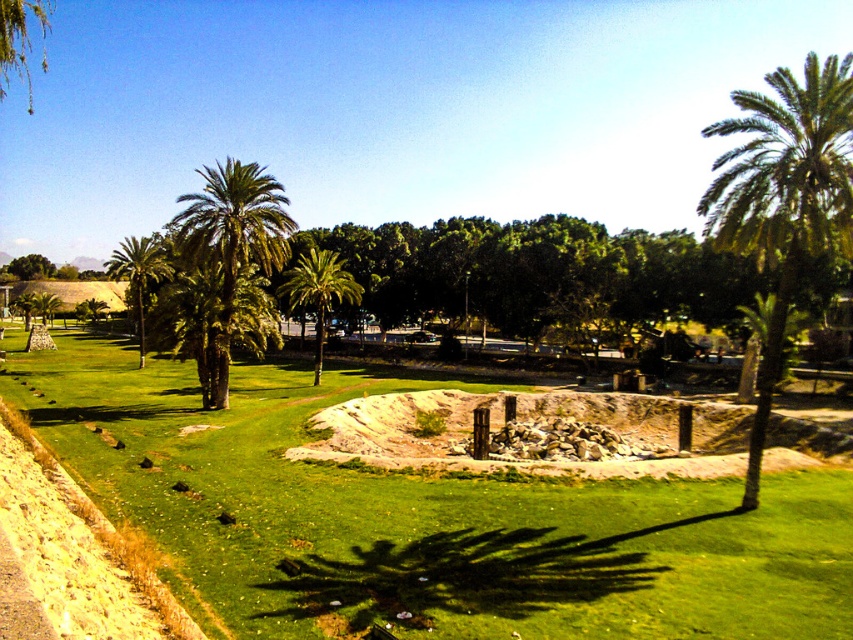
Does green leafy palm tree at center have a larger size compared to green leafy palm tree at left?

Incorrect, green leafy palm tree at center is not larger than green leafy palm tree at left.

Who is more forward, [315,368] or [140,264]?

Point [315,368] is in front.

Locate an element on the screen. Image resolution: width=853 pixels, height=640 pixels. green leafy palm tree at center is located at coordinates (318, 291).

Can you confirm if green leafy palm tree at center-left is thinner than green leafy palm tree at center?

In fact, green leafy palm tree at center-left might be wider than green leafy palm tree at center.

Can you confirm if green leafy palm tree at center-left is taller than green leafy palm tree at center?

Yes.

Which is in front, point (238, 163) or point (320, 352)?

Point (238, 163) is more forward.

The height and width of the screenshot is (640, 853). Find the location of `green leafy palm tree at center-left`. green leafy palm tree at center-left is located at coordinates (235, 234).

Which is more to the right, green leafy palm tree at right or green leafy palm tree at left?

From the viewer's perspective, green leafy palm tree at right appears more on the right side.

Who is shorter, green leafy palm tree at right or green leafy palm tree at left?

green leafy palm tree at left is shorter.

Is point (767, 220) positioned behind point (136, 248)?

No.

This screenshot has width=853, height=640. I want to click on green leafy palm tree at right, so click(784, 198).